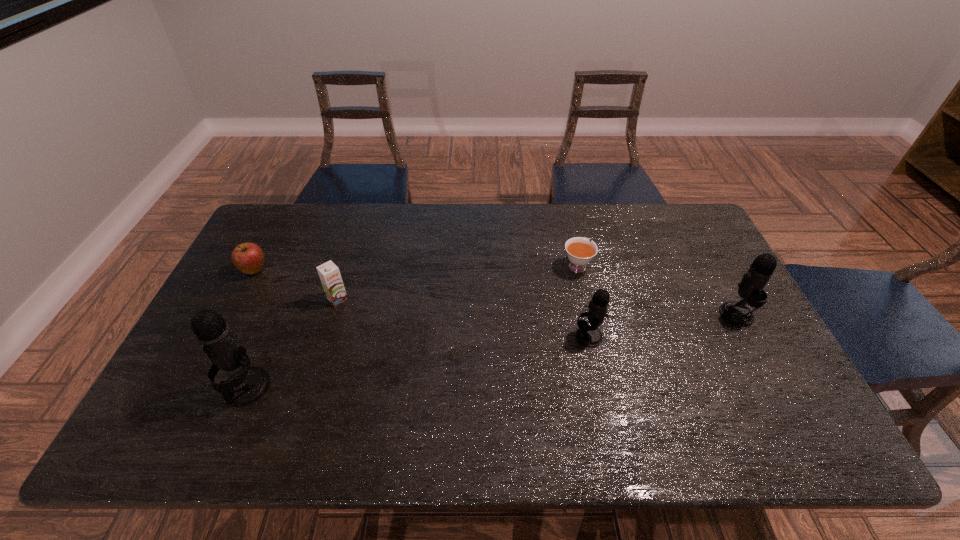
If the aim is uniform spacing by inserting an additional microphone among them, please point to a vacant space for this new microphone. Please provide its 2D coordinates. Your answer should be formatted as a tuple, i.e. [(x, y)], where the tuple contains the x and y coordinates of a point satisfying the conditions above.

[(425, 361)]